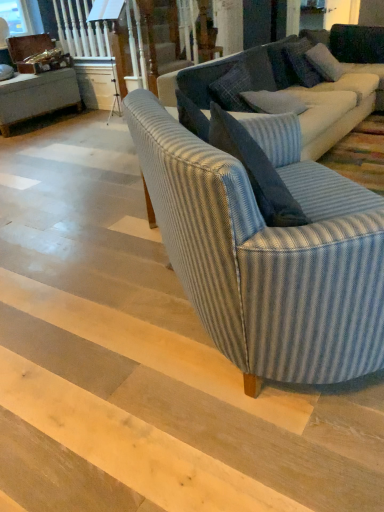
Question: Considering the relative positions of blue striped fabric couch at center, which is the 1th studio couch in back-to-front order, and blue textured pillow at upper right, the second pillow in the front-to-back sequence, in the image provided, is blue striped fabric couch at center, which is the 1th studio couch in back-to-front order, to the right of blue textured pillow at upper right, the second pillow in the front-to-back sequence, from the viewer's perspective?

Choices:
 (A) yes
 (B) no

Answer: (B)

Question: Would you say blue striped fabric couch at center, arranged as the 2th studio couch when viewed from the front, is a long distance from blue textured pillow at upper right, positioned as the 2th pillow in back-to-front order?

Choices:
 (A) yes
 (B) no

Answer: (B)

Question: Is blue striped fabric couch at center, arranged as the 2th studio couch when viewed from the front, to the left of blue textured pillow at upper right, the second pillow in the front-to-back sequence, from the viewer's perspective?

Choices:
 (A) no
 (B) yes

Answer: (B)

Question: Is the depth of blue striped fabric couch at center, arranged as the 2th studio couch when viewed from the front, greater than that of blue textured pillow at upper right, the second pillow in the front-to-back sequence?

Choices:
 (A) no
 (B) yes

Answer: (A)

Question: Considering the relative sizes of blue striped fabric couch at center, which is the 1th studio couch in back-to-front order, and blue textured pillow at upper right, positioned as the 2th pillow in back-to-front order, in the image provided, is blue striped fabric couch at center, which is the 1th studio couch in back-to-front order, thinner than blue textured pillow at upper right, positioned as the 2th pillow in back-to-front order,?

Choices:
 (A) no
 (B) yes

Answer: (A)

Question: In the image, is blue striped fabric couch at center, arranged as the 2th studio couch when viewed from the front, positioned in front of or behind blue striped fabric couch at center, which is the 2th studio couch in back-to-front order?

Choices:
 (A) behind
 (B) front

Answer: (A)

Question: Is blue striped fabric couch at center, which is the 1th studio couch in back-to-front order, bigger or smaller than blue striped fabric couch at center, which is the 2th studio couch in back-to-front order?

Choices:
 (A) small
 (B) big

Answer: (B)

Question: Considering the positions of blue striped fabric couch at center, arranged as the 2th studio couch when viewed from the front, and blue striped fabric couch at center, placed as the 1th studio couch when sorted from front to back, in the image, is blue striped fabric couch at center, arranged as the 2th studio couch when viewed from the front, taller or shorter than blue striped fabric couch at center, placed as the 1th studio couch when sorted from front to back,?

Choices:
 (A) tall
 (B) short

Answer: (B)

Question: Looking at their shapes, would you say blue striped fabric couch at center, arranged as the 2th studio couch when viewed from the front, is wider or thinner than blue striped fabric couch at center, which is the 2th studio couch in back-to-front order?

Choices:
 (A) wide
 (B) thin

Answer: (A)

Question: Based on their positions, is blue textured pillow at upper right, positioned as the 2th pillow in back-to-front order, located to the left or right of blue textured pillow at upper right, the 3th pillow viewed from the front?

Choices:
 (A) right
 (B) left

Answer: (A)

Question: Based on their sizes in the image, would you say blue textured pillow at upper right, positioned as the 2th pillow in back-to-front order, is bigger or smaller than blue textured pillow at upper right, placed as the first pillow when sorted from back to front?

Choices:
 (A) small
 (B) big

Answer: (A)

Question: In terms of width, does blue textured pillow at upper right, the second pillow in the front-to-back sequence, look wider or thinner when compared to blue textured pillow at upper right, placed as the first pillow when sorted from back to front?

Choices:
 (A) thin
 (B) wide

Answer: (A)

Question: Is point (321, 53) positioned closer to the camera than point (286, 82)?

Choices:
 (A) farther
 (B) closer

Answer: (A)

Question: Is blue textured pillow at upper right, the 3th pillow viewed from the front, to the left or to the right of blue striped fabric couch at center, which is the 1th studio couch in back-to-front order, in the image?

Choices:
 (A) right
 (B) left

Answer: (B)

Question: From the image's perspective, is blue textured pillow at upper right, the 3th pillow viewed from the front, located above or below blue striped fabric couch at center, which is the 1th studio couch in back-to-front order?

Choices:
 (A) above
 (B) below

Answer: (A)